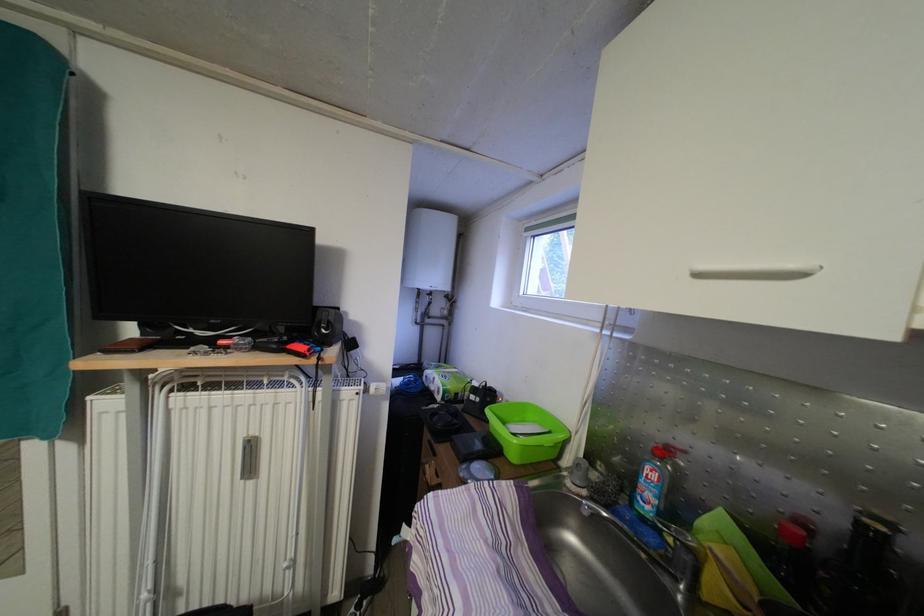
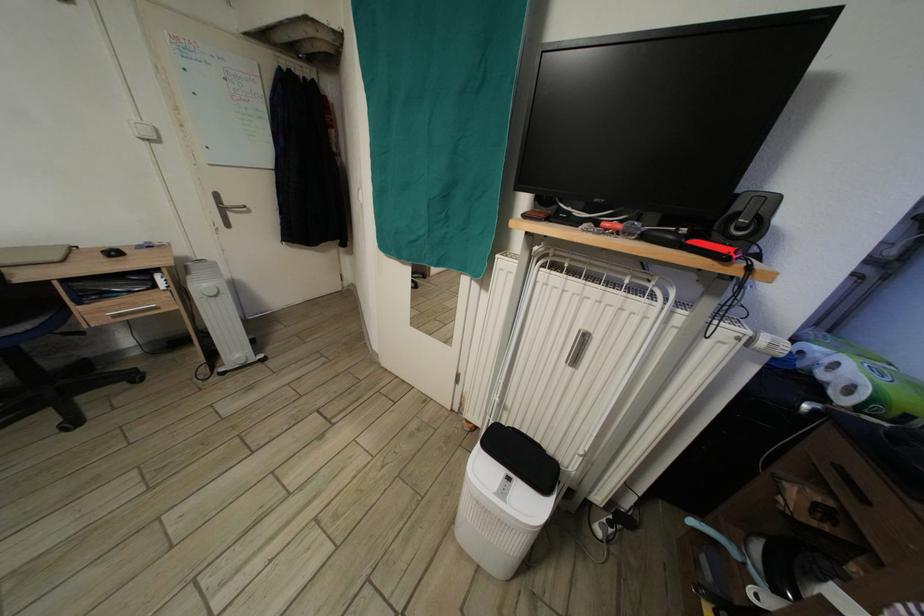
The first image is from the beginning of the video and the second image is from the end. How did the camera likely rotate when shooting the video?

The camera rotated toward left-down.